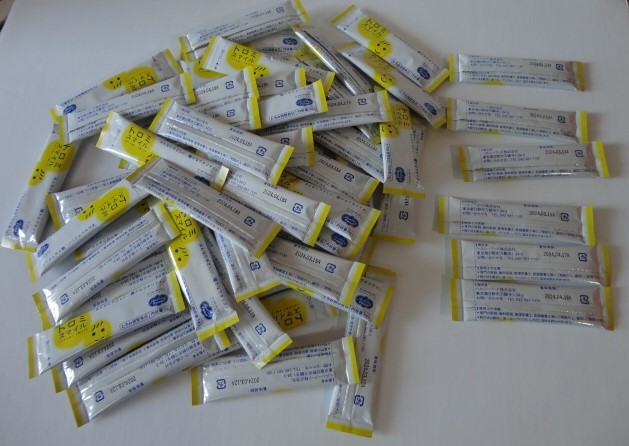
This screenshot has width=629, height=446. In order to click on product face-down on table in this screenshot , I will do `click(504, 291)`, `click(511, 258)`, `click(529, 216)`, `click(535, 156)`, `click(536, 122)`, `click(540, 71)`, `click(243, 26)`, `click(143, 370)`, `click(357, 389)`, `click(399, 214)`.